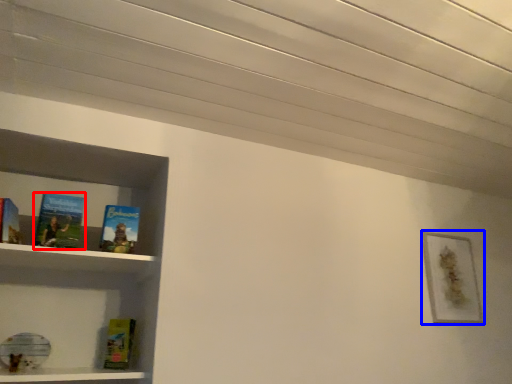
Question: Which point is closer to the camera, book (highlighted by a red box) or picture frame (highlighted by a blue box)?

Choices:
 (A) book
 (B) picture frame

Answer: (A)